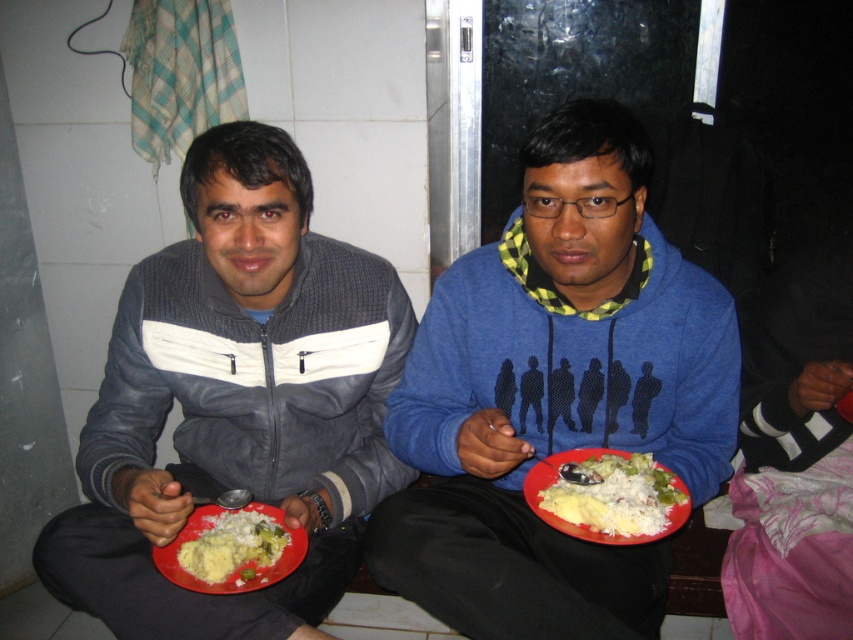
Can you confirm if matte gray jacket at left is bigger than white matte rice at center?

Correct, matte gray jacket at left is larger in size than white matte rice at center.

Is matte gray jacket at left taller than white matte rice at center?

Yes, matte gray jacket at left is taller than white matte rice at center.

The height and width of the screenshot is (640, 853). I want to click on matte gray jacket at left, so click(236, 401).

You are a GUI agent. You are given a task and a screenshot of the screen. Output one action in this format:
    pyautogui.click(x=<x>, y=<y>)
    Task: Click on the white matte rice at center
    The width and height of the screenshot is (853, 640).
    Given the screenshot: What is the action you would take?
    pyautogui.click(x=608, y=497)

Is white matte rice at center positioned in front of white rice with green vegetables at lower left?

Yes.

Which is in front, point (561, 481) or point (230, 560)?

Positioned in front is point (230, 560).

The width and height of the screenshot is (853, 640). What are the coordinates of `white matte rice at center` in the screenshot? It's located at (608, 497).

At what (x,y) coordinates should I click in order to perform the action: click on blue fleece hoodie at center. Please return your answer as a coordinate pair (x, y). This screenshot has width=853, height=640. Looking at the image, I should click on (555, 394).

Which is behind, point (682, 477) or point (642, 472)?

The point (682, 477) is more distant.

Image resolution: width=853 pixels, height=640 pixels. I want to click on blue fleece hoodie at center, so click(555, 394).